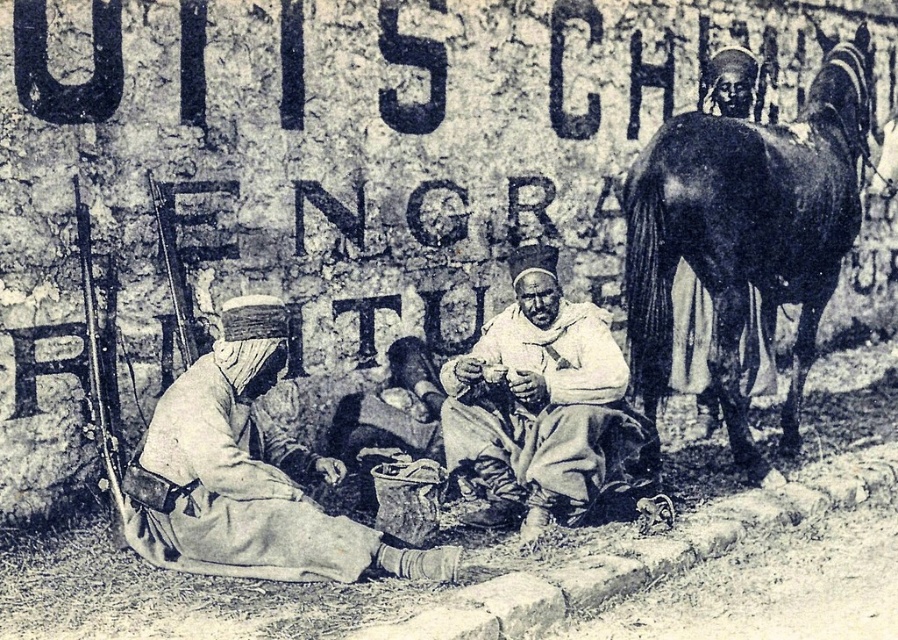
You are an artist trying to sketch this historical scene. You need to ensure the proportions between the dark brown glossy horse at right and the light beige fabric at center are accurate. Which object should you draw first to maintain the correct size relationship?

You should draw the dark brown glossy horse at right first because its width is greater than the light beige fabric at center, so starting with the larger object ensures proper scaling when adding the smaller one.

You are an archaeologist examining this historical image. You notice the dark brown glossy horse at right and the light beige fabric at center. Which object is taller in the scene?

The dark brown glossy horse at right is much taller than the light beige fabric at center.

In the historical photograph described, there is a dark brown glossy horse at right and a light beige fabric at center. Which object is positioned to the right of the other?

The dark brown glossy horse at right is to the right of the light beige fabric at center.